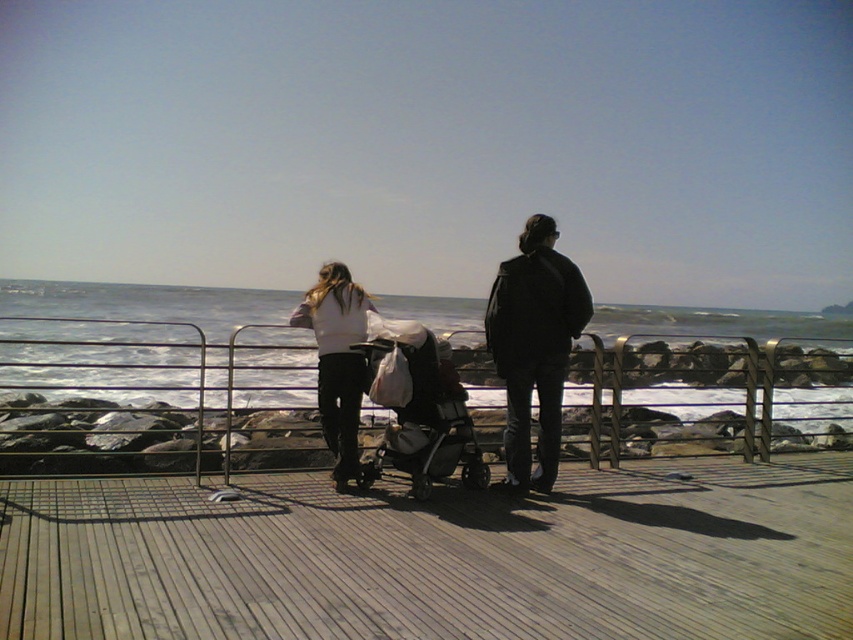
You are a photographer trying to capture the blue water at center and the white matte shirt at center in the same frame. Based on their positions, which one will appear higher in your camera view?

The blue water at center appears higher in the camera view because it is positioned above the white matte shirt at center.

You are a photographer trying to capture a photo of the black fabric stroller at center and the white matte shirt at center. Since you want to ensure both are in focus, you need to know which object is wider. Which one is wider?

The black fabric stroller at center is wider than the white matte shirt at center according to the description.